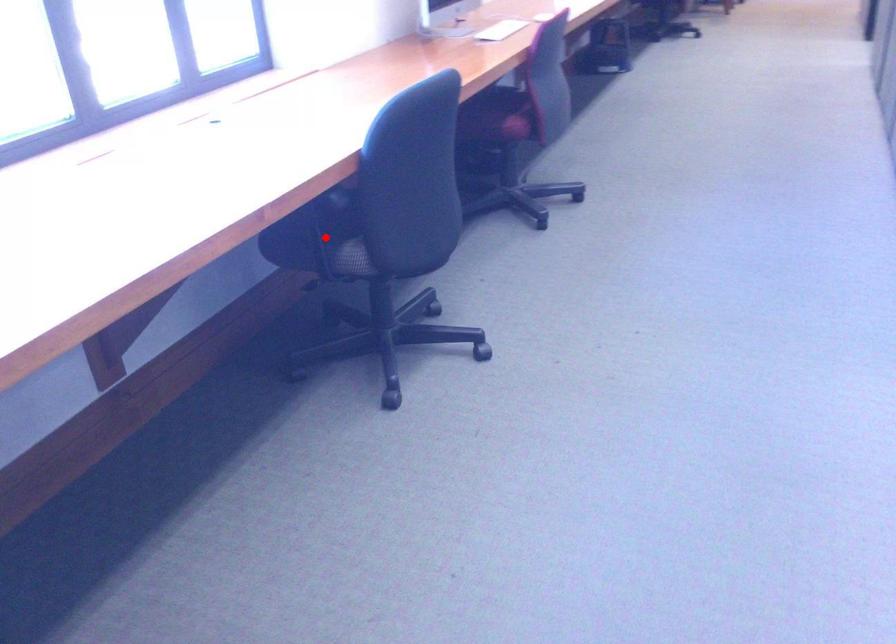
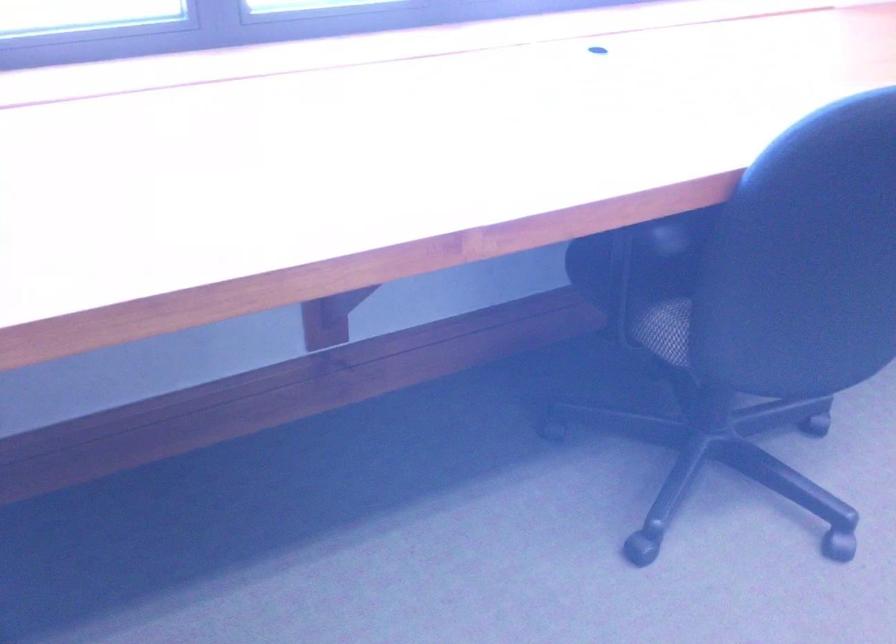
Question: I am providing you with two images of the same scene from different viewpoints. Image1 has a red point marked. In image2, the corresponding 3D location appears at what relative position? Reply with the corresponding letter.

Choices:
 (A) Closer
 (B) Farther

Answer: (A)